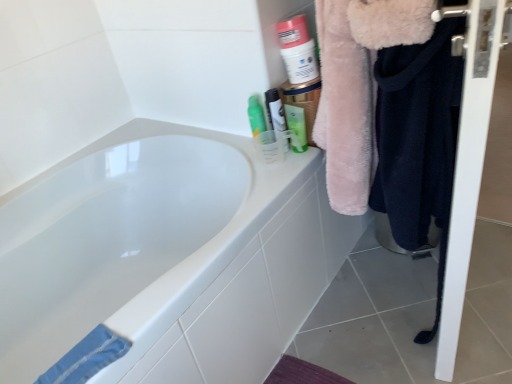
Question: Does white glossy bathtub at upper left have a larger size compared to white glossy screen door at right?

Choices:
 (A) no
 (B) yes

Answer: (B)

Question: Does white glossy bathtub at upper left lie in front of white glossy screen door at right?

Choices:
 (A) no
 (B) yes

Answer: (A)

Question: From a real-world perspective, is white glossy bathtub at upper left physically below white glossy screen door at right?

Choices:
 (A) yes
 (B) no

Answer: (A)

Question: Are white glossy bathtub at upper left and white glossy screen door at right located far from each other?

Choices:
 (A) yes
 (B) no

Answer: (B)

Question: Is white glossy bathtub at upper left at the left side of white glossy screen door at right?

Choices:
 (A) yes
 (B) no

Answer: (A)

Question: In terms of size, does faded denim towel at lower left appear bigger or smaller than translucent plastic cup at upper right, the 2th mouthwash in the right-to-left sequence?

Choices:
 (A) small
 (B) big

Answer: (A)

Question: From the image's perspective, is faded denim towel at lower left positioned above or below translucent plastic cup at upper right, the 2th mouthwash in the right-to-left sequence?

Choices:
 (A) below
 (B) above

Answer: (A)

Question: In terms of width, does faded denim towel at lower left look wider or thinner when compared to translucent plastic cup at upper right, arranged as the 1th mouthwash when viewed from the left?

Choices:
 (A) wide
 (B) thin

Answer: (A)

Question: Choose the correct answer: Is faded denim towel at lower left inside translucent plastic cup at upper right, arranged as the 1th mouthwash when viewed from the left, or outside it?

Choices:
 (A) inside
 (B) outside

Answer: (B)

Question: Based on their positions, is faded denim towel at lower left located to the left or right of white glossy screen door at right?

Choices:
 (A) left
 (B) right

Answer: (A)

Question: Is faded denim towel at lower left wider or thinner than white glossy screen door at right?

Choices:
 (A) thin
 (B) wide

Answer: (A)

Question: Does point (90, 357) appear closer or farther from the camera than point (479, 91)?

Choices:
 (A) farther
 (B) closer

Answer: (A)

Question: From a real-world perspective, relative to white glossy screen door at right, is faded denim towel at lower left vertically above or below?

Choices:
 (A) below
 (B) above

Answer: (B)

Question: From the image's perspective, relative to green matte tube at upper right, marked as the 1th mouthwash in a right-to-left arrangement, is white glossy screen door at right above or below?

Choices:
 (A) above
 (B) below

Answer: (B)

Question: Is white glossy screen door at right spatially inside green matte tube at upper right, which ranks as the second mouthwash in left-to-right order, or outside of it?

Choices:
 (A) inside
 (B) outside

Answer: (B)